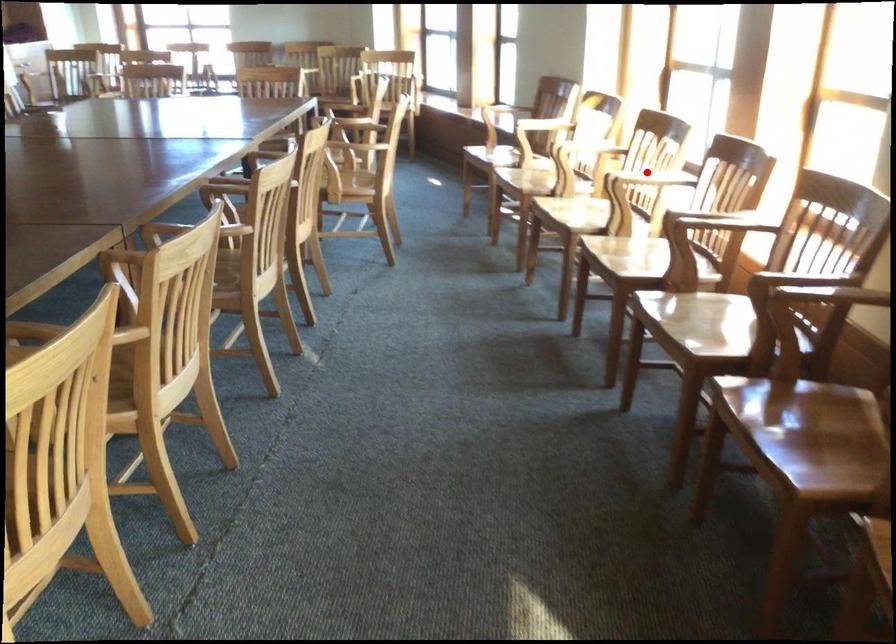
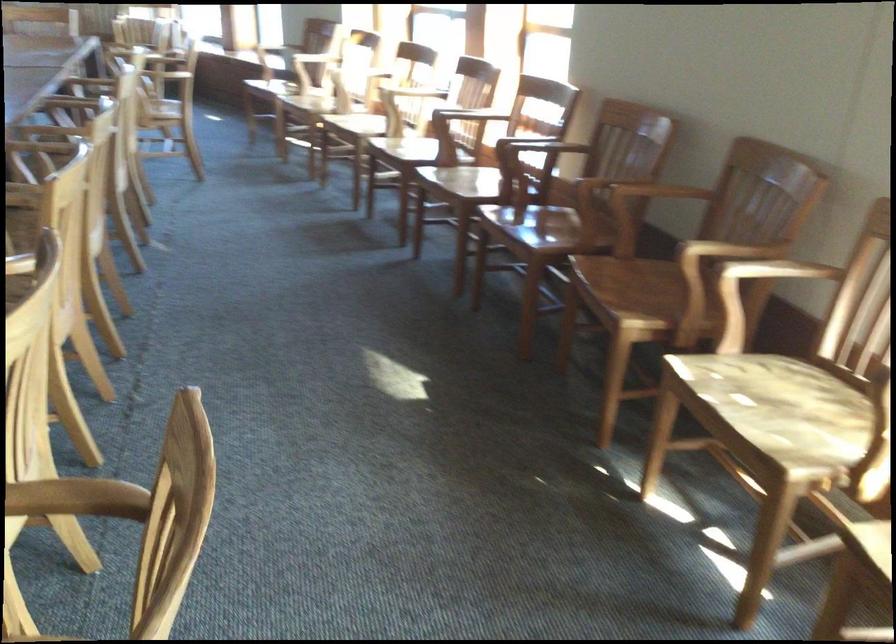
Question: I am providing you with two images of the same scene from different viewpoints. In image1, a red point is highlighted. Considering the same 3D point in image2, which of the following is correct?

Choices:
 (A) It is closer
 (B) It is farther

Answer: (B)